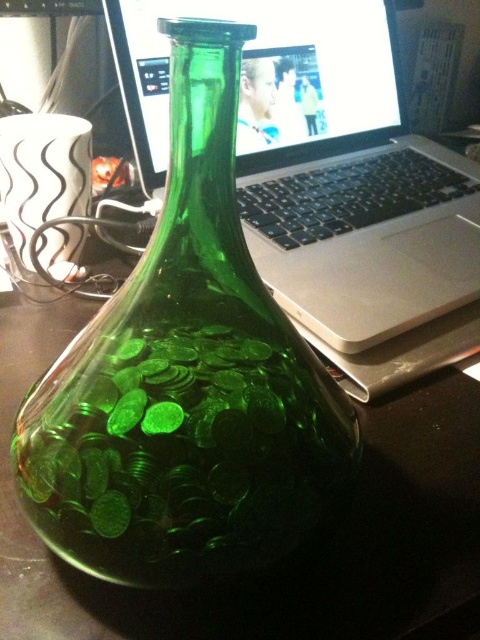
You are looking at the image and want to place a sticker on the point that is closer to you. Which point should you choose between point (227, 508) and point (408, 220)?

Point (227, 508) is closer to the camera than point (408, 220), so you should choose point (227, 508) to place the sticker.

You are organizing a desk and need to place a small plant between the green glass vase at center and the sleek silver laptop at center. Based on their positions, which object should the plant be closer to?

The plant should be placed closer to the sleek silver laptop at center because the green glass vase at center is to the left of the sleek silver laptop at center, meaning the laptop is on the right side. Therefore, placing the plant between them would require it to be closer to the laptop to maintain balance.

You are organizing items on a desk and want to place a small plant between the green glass vase at center and the sleek silver laptop at center. Based on their positions, which object should the plant be closer to?

The plant should be placed closer to the sleek silver laptop at center because the green glass vase at center is closer to the viewer, meaning the laptop is further back. Placing the plant closer to the laptop would maintain a balanced arrangement.